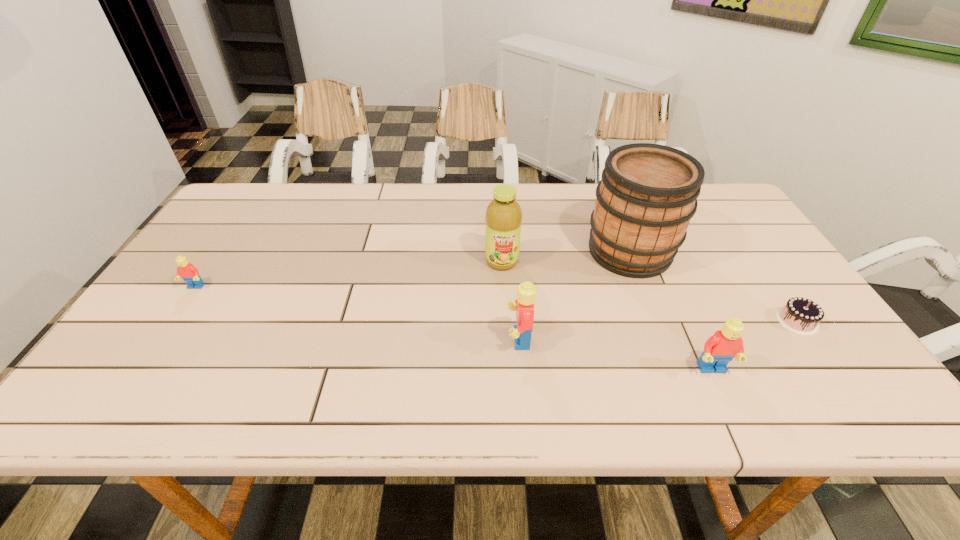
Where is `vacant region between the nearest Lego and the leftmost Lego`? vacant region between the nearest Lego and the leftmost Lego is located at coordinates (454, 328).

Locate an element on the screen. This screenshot has width=960, height=540. vacant space that's between the tallest object and the nearest Lego is located at coordinates (671, 310).

Find the location of a particular element. free space between the fruit juice and the chocolate cake is located at coordinates (649, 291).

Locate an element on the screen. The image size is (960, 540). the third closest object relative to the fruit juice is located at coordinates (723, 346).

Locate an element on the screen. the second closest object to the shortest object is located at coordinates click(x=648, y=194).

Locate an element on the screen. This screenshot has height=540, width=960. Lego that is the closest one to the second Lego from right to left is located at coordinates (723, 346).

Select which Lego appears as the third closest to the chocolate cake. Please provide its 2D coordinates. Your answer should be formatted as a tuple, i.e. [(x, y)], where the tuple contains the x and y coordinates of a point satisfying the conditions above.

[(189, 273)]

Identify the location of vacant space that satisfies the following two spatial constraints: 1. on the front side of the cider; 2. on the face of the second Lego from right to left. The width and height of the screenshot is (960, 540). (663, 339).

This screenshot has height=540, width=960. I want to click on vacant area in the image that satisfies the following two spatial constraints: 1. on the face of the third farthest object; 2. on the right side of the shortest object, so click(173, 321).

Locate an element on the screen. vacant position in the image that satisfies the following two spatial constraints: 1. on the front side of the tallest object; 2. on the face of the second nearest Lego is located at coordinates (663, 339).